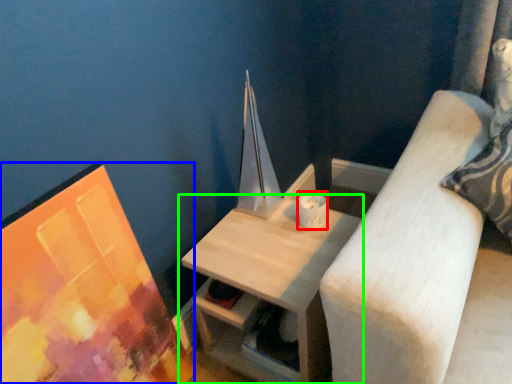
Question: Based on their relative distances, which object is farther from candle holder (highlighted by a red box)? Choose from picture frame (highlighted by a blue box) and table (highlighted by a green box).

Choices:
 (A) picture frame
 (B) table

Answer: (A)